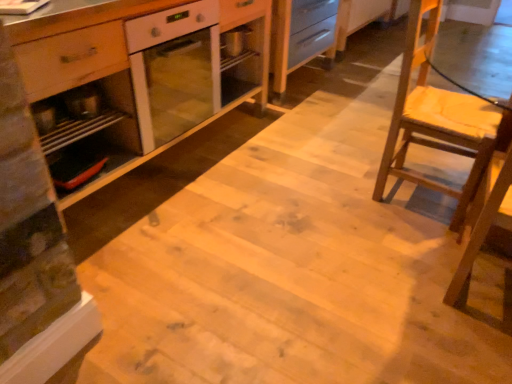
Question: Is white glossy oven at center bigger than wooden chair at right?

Choices:
 (A) yes
 (B) no

Answer: (A)

Question: Considering the relative sizes of white glossy oven at center and wooden chair at right in the image provided, is white glossy oven at center taller than wooden chair at right?

Choices:
 (A) no
 (B) yes

Answer: (A)

Question: Can you confirm if white glossy oven at center is positioned to the left of wooden chair at right?

Choices:
 (A) no
 (B) yes

Answer: (B)

Question: Can you confirm if white glossy oven at center is smaller than wooden chair at right?

Choices:
 (A) no
 (B) yes

Answer: (A)

Question: Can you confirm if white glossy oven at center is thinner than wooden chair at right?

Choices:
 (A) no
 (B) yes

Answer: (A)

Question: Is white glossy oven at center in front of or behind wooden chair at right in the image?

Choices:
 (A) front
 (B) behind

Answer: (A)

Question: Considering the positions of white glossy oven at center and wooden chair at right in the image, is white glossy oven at center bigger or smaller than wooden chair at right?

Choices:
 (A) big
 (B) small

Answer: (A)

Question: Looking at their shapes, would you say white glossy oven at center is wider or thinner than wooden chair at right?

Choices:
 (A) thin
 (B) wide

Answer: (B)

Question: From a real-world perspective, relative to wooden chair at right, is white glossy oven at center vertically above or below?

Choices:
 (A) above
 (B) below

Answer: (B)

Question: Is wooden chair at right to the left or to the right of metallic silver tray at left in the image?

Choices:
 (A) right
 (B) left

Answer: (A)

Question: In terms of height, does wooden chair at right look taller or shorter compared to metallic silver tray at left?

Choices:
 (A) tall
 (B) short

Answer: (A)

Question: Is point (414, 89) closer or farther from the camera than point (106, 124)?

Choices:
 (A) closer
 (B) farther

Answer: (B)

Question: Choose the correct answer: Is wooden chair at right inside metallic silver tray at left or outside it?

Choices:
 (A) inside
 (B) outside

Answer: (B)

Question: Considering the positions of metallic silver tray at left and wooden chair at right in the image, is metallic silver tray at left wider or thinner than wooden chair at right?

Choices:
 (A) wide
 (B) thin

Answer: (B)

Question: Is metallic silver tray at left taller or shorter than wooden chair at right?

Choices:
 (A) short
 (B) tall

Answer: (A)